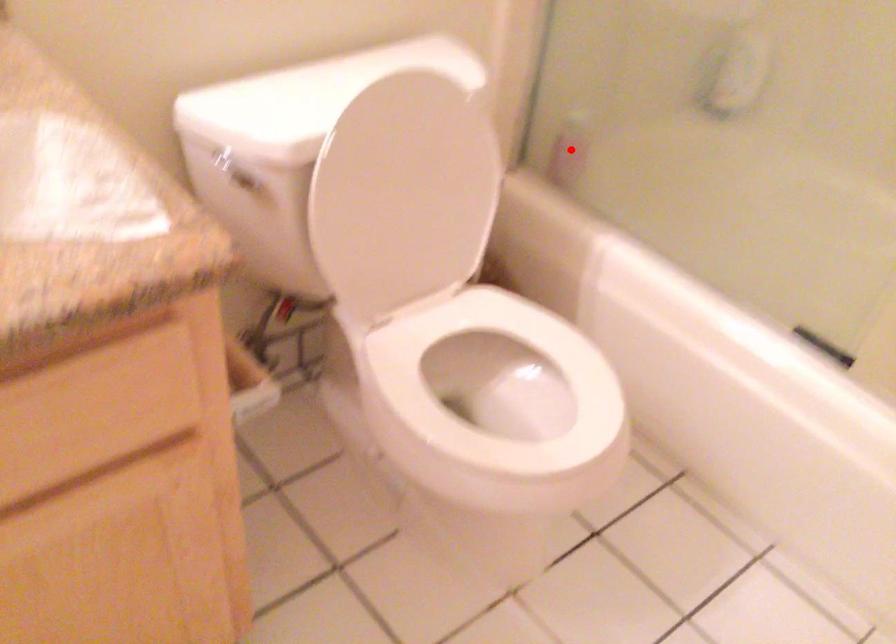
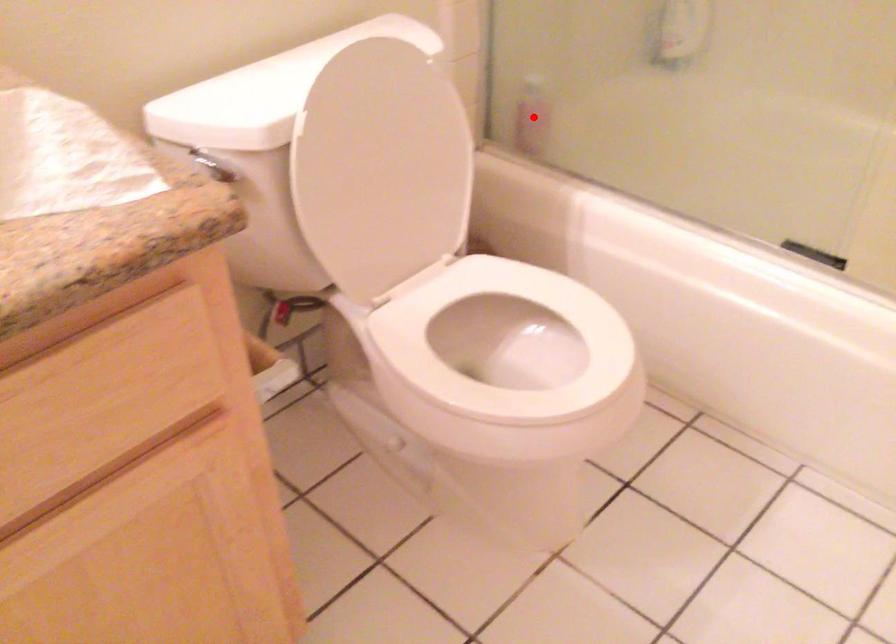
I am providing you with two images of the same scene from different viewpoints. A red point is marked on the first image and another point is marked on the second image. Is the marked point in image1 the same physical position as the marked point in image2?

A: Yes